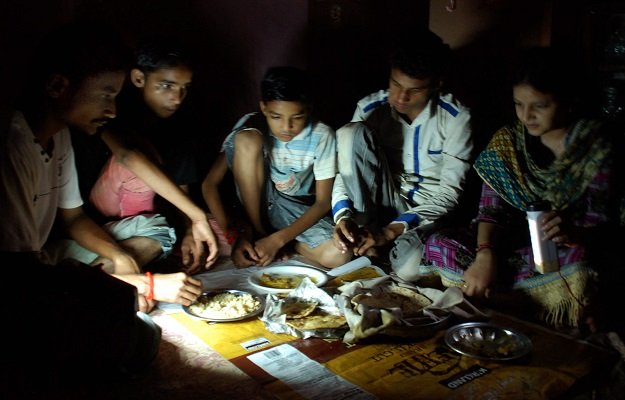
You are a GUI agent. You are given a task and a screenshot of the screen. Output one action in this format:
    pyautogui.click(x=<x>, y=<y>)
    Task: Click on the background wall
    
    Given the screenshot: What is the action you would take?
    pyautogui.click(x=241, y=31)